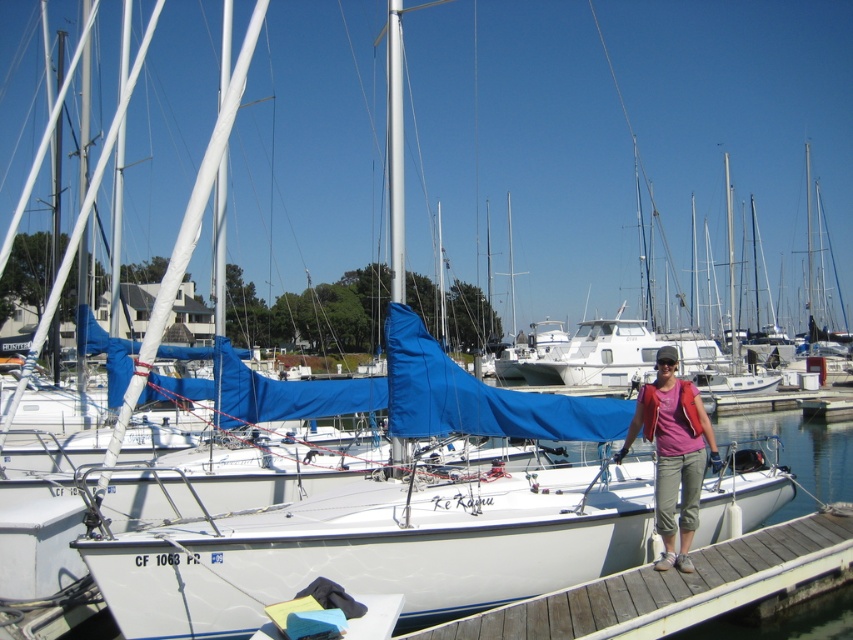
You are a maintenance worker with a 1.2 meter long tool. You need to reach from the wooden at lower right to the matte pink shirt at center. Is your tool long enough to cover the distance?

The distance between wooden at lower right and matte pink shirt at center is 1.09 meters, so the 1.2 meter tool is long enough to cover the distance.

You are a photographer positioned at the edge of the wooden pier. You want to take a photo of the wooden at lower right and the matte pink shirt at center so that both are clearly visible. Which object should you focus on first to ensure both are in focus?

The wooden at lower right is in front of the matte pink shirt at center, so you should focus on the wooden at lower right first to ensure both are in focus.